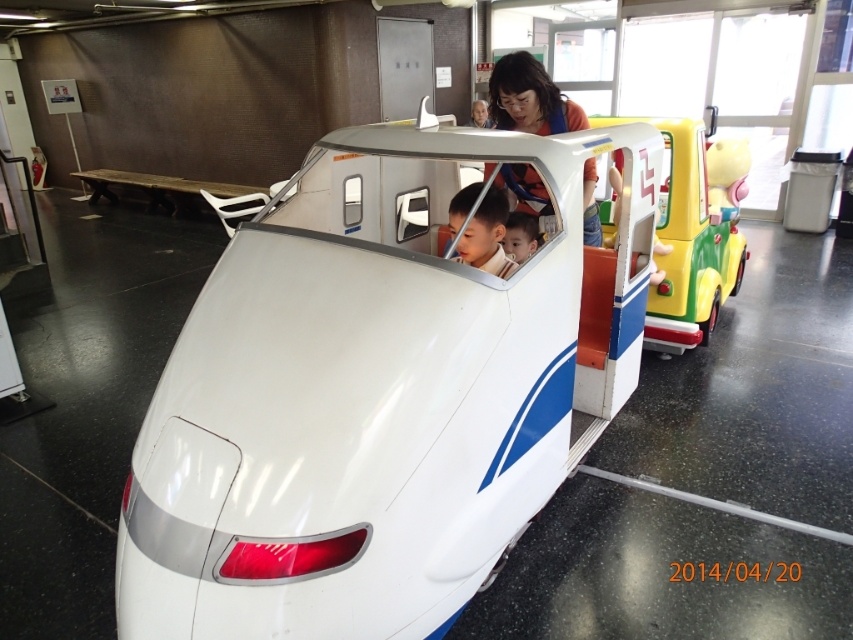
You are a parent at the train station. You see your child sitting on the white glossy train at center and the smooth skin face at center. Which object is closer to the floor?

The white glossy train at center is closer to the floor because it is located below the smooth skin face at center.